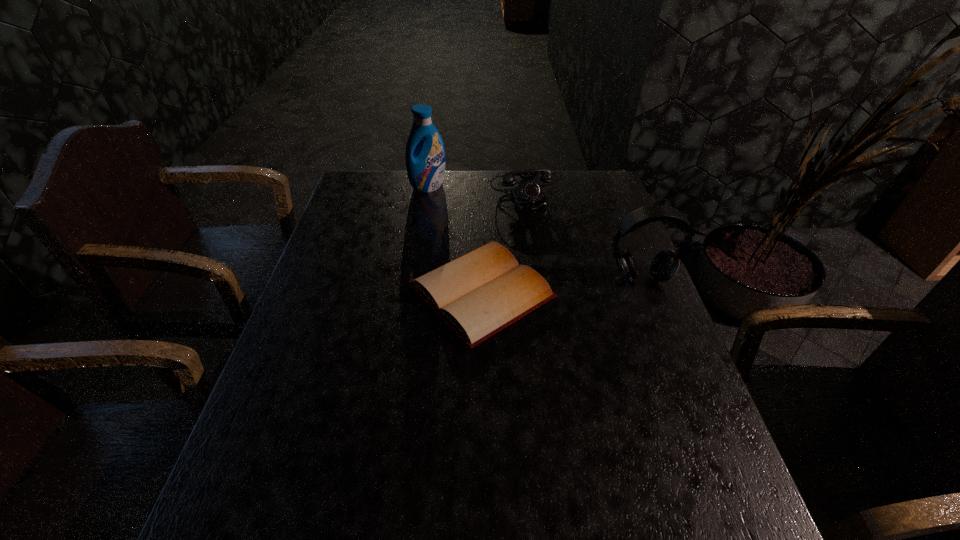
Image resolution: width=960 pixels, height=540 pixels. Find the location of `Bible`. Bible is located at coordinates (480, 293).

The image size is (960, 540). Find the location of `earphone`. earphone is located at coordinates (665, 263).

The image size is (960, 540). I want to click on the third shortest object, so click(x=665, y=263).

Find the location of `the second shortest object`. the second shortest object is located at coordinates (528, 196).

You are a GUI agent. You are given a task and a screenshot of the screen. Output one action in this format:
    pyautogui.click(x=<x>, y=<y>)
    Task: Click on the detergent
    
    Given the screenshot: What is the action you would take?
    pyautogui.click(x=425, y=164)

Identify the location of free space located on the front of the Bible. (482, 380).

The height and width of the screenshot is (540, 960). Identify the location of free location located on the ear cups of the rightmost object. (689, 403).

Where is `vacant space located on the front-facing side of the second shortest object`? vacant space located on the front-facing side of the second shortest object is located at coordinates (549, 245).

Locate an element on the screen. vacant space located 0.170m on the front-facing side of the second shortest object is located at coordinates (549, 245).

You are a GUI agent. You are given a task and a screenshot of the screen. Output one action in this format:
    pyautogui.click(x=<x>, y=<y>)
    Task: Click on the free space located 0.390m on the front-facing side of the second shortest object
    Image resolution: width=960 pixels, height=540 pixels.
    Given the screenshot: What is the action you would take?
    pyautogui.click(x=572, y=297)